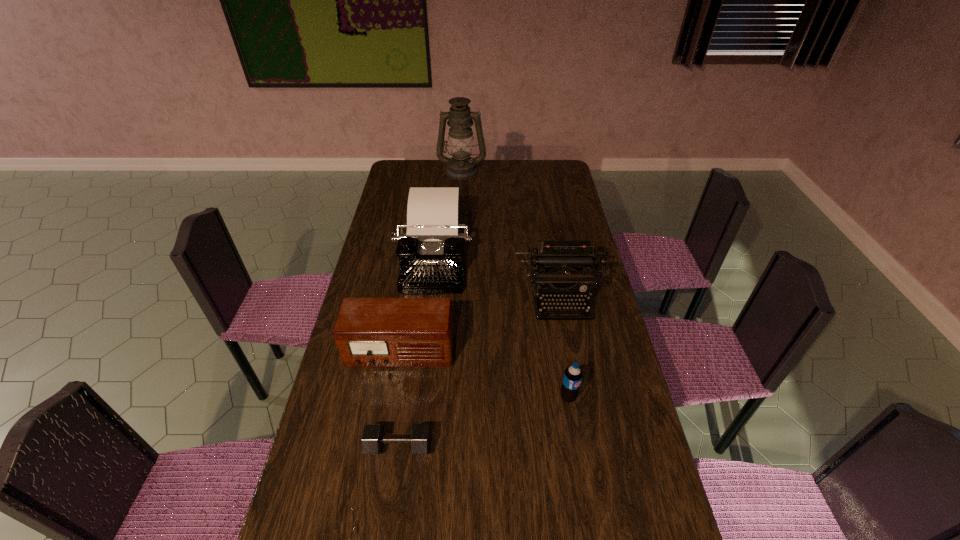
I want to click on the tallest object, so click(461, 166).

You are a GUI agent. You are given a task and a screenshot of the screen. Output one action in this format:
    pyautogui.click(x=<x>, y=<y>)
    Task: Click on the farthest object
    This screenshot has height=540, width=960.
    Given the screenshot: What is the action you would take?
    pyautogui.click(x=461, y=166)

The image size is (960, 540). I want to click on the left typewriter, so click(x=431, y=254).

The height and width of the screenshot is (540, 960). In order to click on the right typewriter in this screenshot , I will do `click(560, 262)`.

Locate an element on the screen. The image size is (960, 540). the fourth farthest object is located at coordinates (369, 332).

In order to click on the second nearest object in this screenshot , I will do `click(572, 378)`.

This screenshot has height=540, width=960. I want to click on dumbbell, so click(373, 438).

This screenshot has height=540, width=960. Identify the location of the nearest object. (373, 438).

The image size is (960, 540). I want to click on vacant space located 0.090m on the right of the oil lamp, so click(x=504, y=171).

Image resolution: width=960 pixels, height=540 pixels. Identify the location of free space located on the keys of the left typewriter. (416, 391).